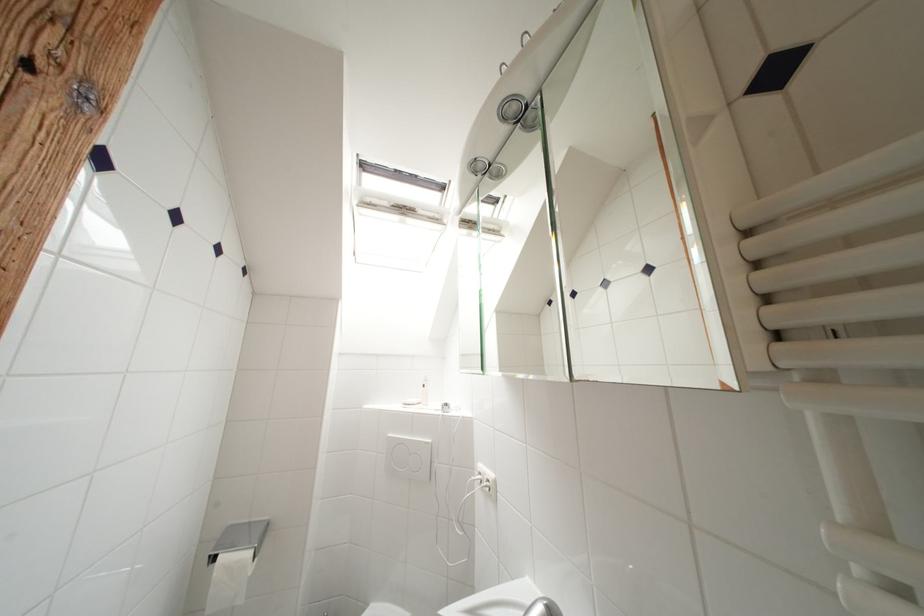
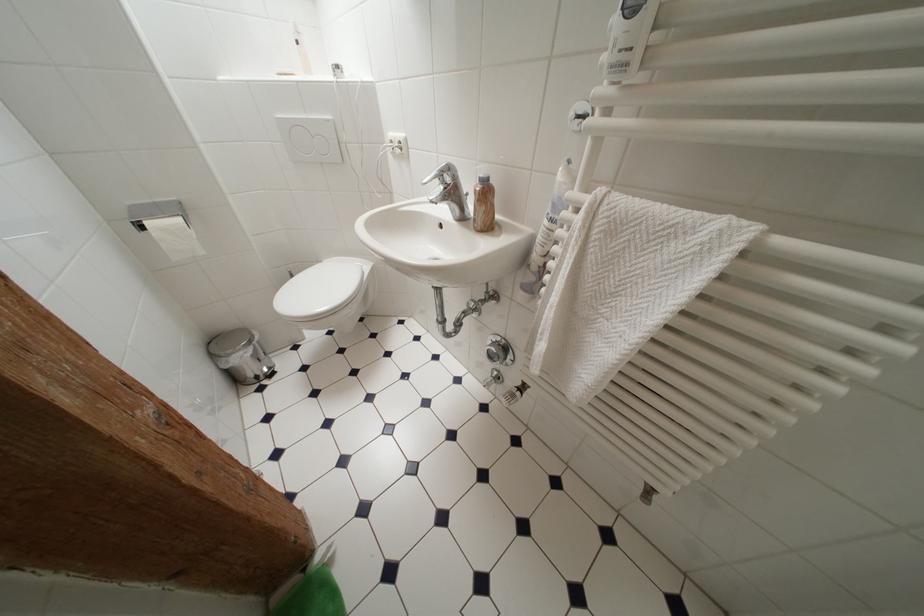
Find the pixel in the second image that matches the point at 432,446 in the first image.

(333, 124)